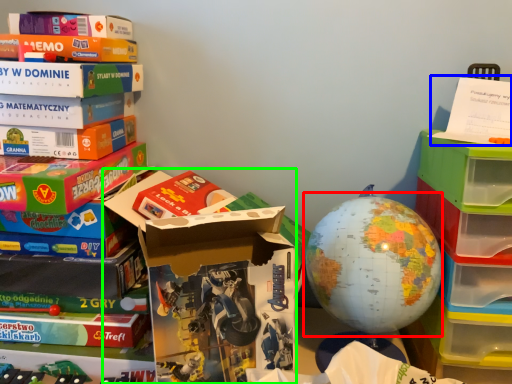
Question: Considering the real-world distances, which object is farthest from earth (highlighted by a red box)? paperback book (highlighted by a blue box) or storage box (highlighted by a green box)?

Choices:
 (A) paperback book
 (B) storage box

Answer: (A)